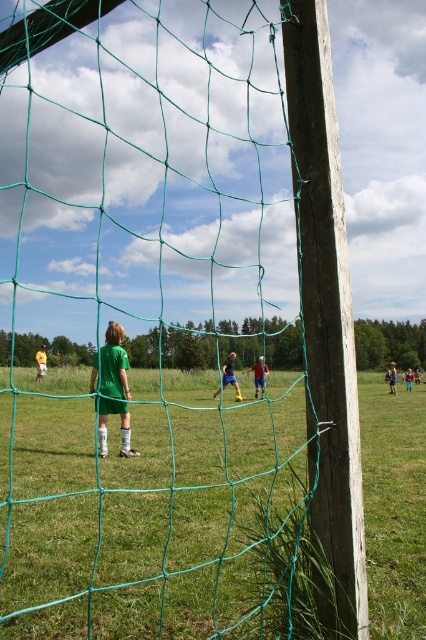
Does green matte soccer player at center have a smaller size compared to green jersey boy at center?

Indeed, green matte soccer player at center has a smaller size compared to green jersey boy at center.

Does point (106, 451) come farther from viewer compared to point (227, 372)?

No, (106, 451) is in front of (227, 372).

Who is more forward, (x=103, y=356) or (x=227, y=384)?

Point (x=103, y=356) is more forward.

In order to click on green matte soccer player at center in this screenshot , I will do `click(114, 388)`.